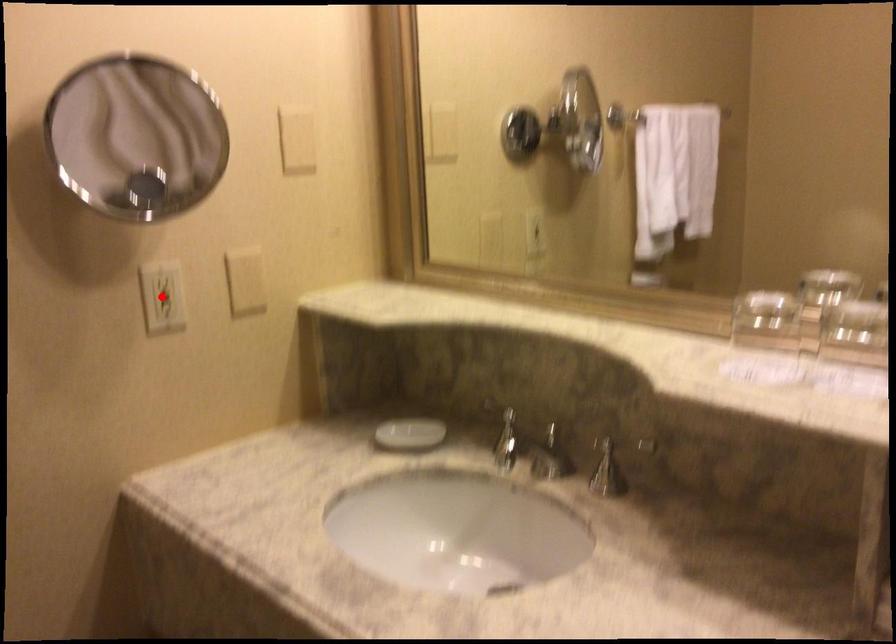
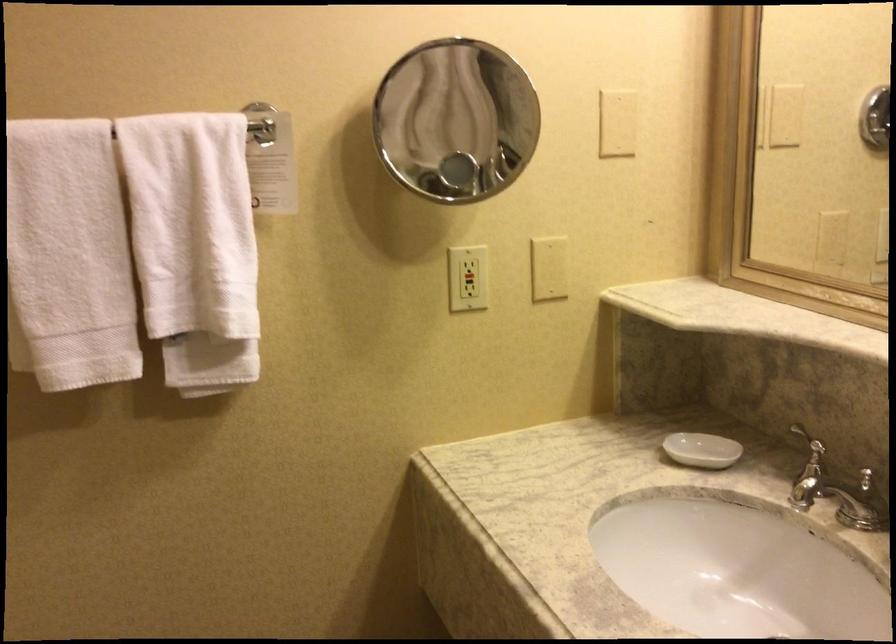
Find the pixel in the second image that matches the highlighted location in the first image.

(467, 278)